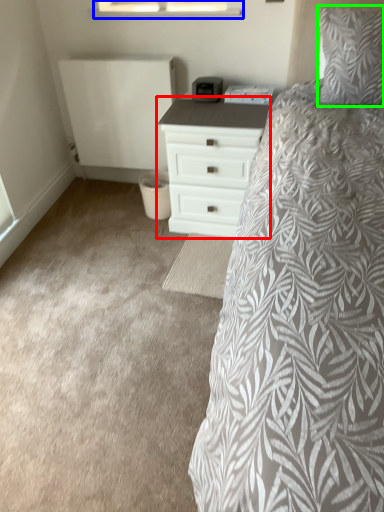
Question: Which object is the closest to the chest of drawers (highlighted by a red box)? Choose among these: window (highlighted by a blue box) or pillow (highlighted by a green box).

Choices:
 (A) window
 (B) pillow

Answer: (B)